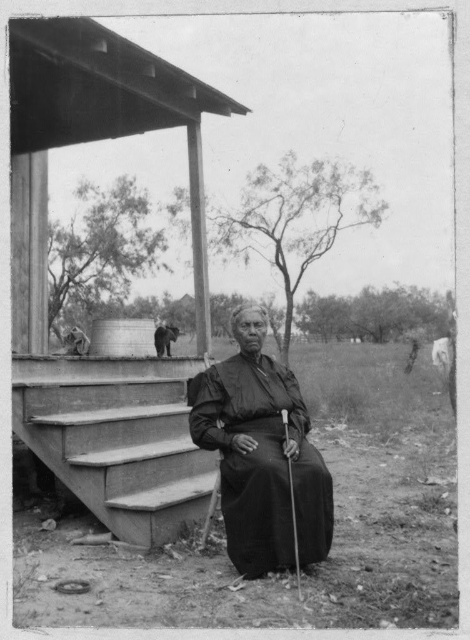
Question: Does smooth concrete stairs at center appear over smooth gray cat at upper left?

Choices:
 (A) yes
 (B) no

Answer: (B)

Question: Does wooden gazebo at upper center have a smaller size compared to black matte dress at center?

Choices:
 (A) no
 (B) yes

Answer: (B)

Question: Which point is closer to the camera?

Choices:
 (A) black matte dress at center
 (B) wooden gazebo at upper center
 (C) smooth concrete stairs at center

Answer: (A)

Question: Is black matte dress at center to the left of smooth gray cat at upper left from the viewer's perspective?

Choices:
 (A) no
 (B) yes

Answer: (A)

Question: Which is farther from the smooth concrete stairs at center?

Choices:
 (A) black matte dress at center
 (B) wooden gazebo at upper center
 (C) smooth gray cat at upper left

Answer: (B)

Question: Which point appears farthest from the camera in this image?

Choices:
 (A) (107, 440)
 (B) (123, 483)
 (C) (302, 461)
 (D) (158, 324)

Answer: (D)